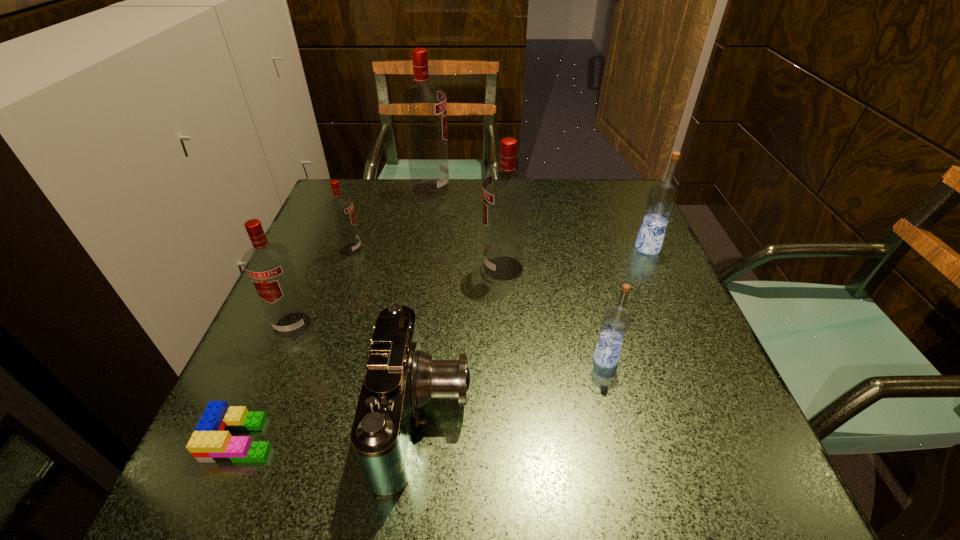
Identify the location of object positioned at the near left corner. Image resolution: width=960 pixels, height=540 pixels. (211, 441).

Locate an element on the screen. The width and height of the screenshot is (960, 540). free space at the far edge of the desktop is located at coordinates (482, 228).

Where is `free space at the right edge of the desktop`? free space at the right edge of the desktop is located at coordinates (645, 435).

Where is `free location at the near left corner`? free location at the near left corner is located at coordinates (266, 502).

Where is `free location at the far right corner of the desktop`? free location at the far right corner of the desktop is located at coordinates (598, 219).

Where is `free space at the near right corner of the desktop`? The image size is (960, 540). free space at the near right corner of the desktop is located at coordinates (708, 480).

This screenshot has height=540, width=960. I want to click on vacant space that is in between the rightmost object and the tallest object, so click(x=539, y=219).

Locate an element on the screen. free space between the sixth object from left to right and the smallest red vodka is located at coordinates (427, 259).

This screenshot has width=960, height=540. Find the location of `empty location between the fifth farthest vodka and the seventh tallest object`. empty location between the fifth farthest vodka and the seventh tallest object is located at coordinates (359, 372).

Where is `free space between the third red vodka from left to right and the smallest red vodka`? This screenshot has height=540, width=960. free space between the third red vodka from left to right and the smallest red vodka is located at coordinates (391, 219).